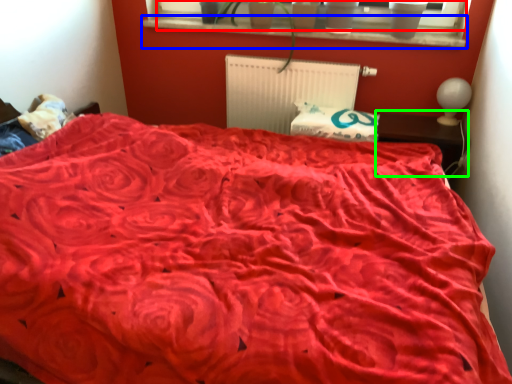
Question: Which object is positioned farthest from window screen (highlighted by a red box)? Select from window sill (highlighted by a blue box) and table (highlighted by a green box).

Choices:
 (A) window sill
 (B) table

Answer: (B)